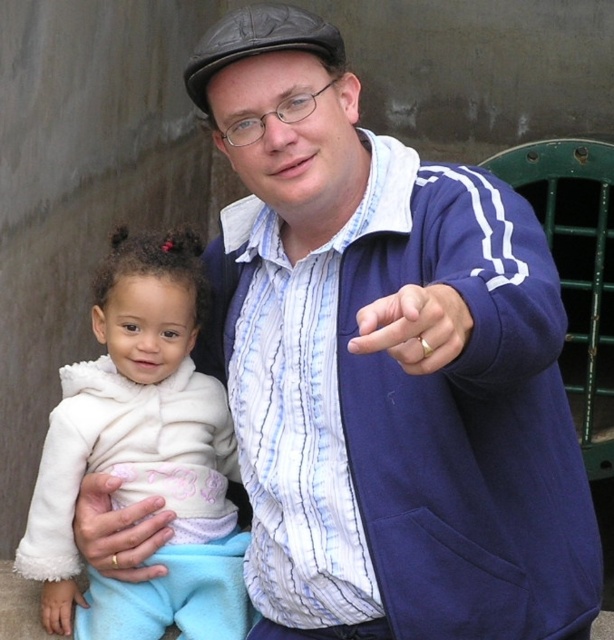
In the scene shown: You are a photographer setting up for a family portrait. You need to ensure that the blue fleece jacket at center and the gold ring at lower left are both visible in the frame. Based on their sizes, which object will appear larger in the final photo?

The blue fleece jacket at center will appear larger in the final photo because it is taller than the gold ring at lower left.

You are a photographer setting up for a family photo shoot. You notice the white fluffy coat at left and the gold ring at lower left in the scene. Where should you place your camera to ensure both items are visible in the frame?

Place the camera to the left side of the scene so that the white fluffy coat at left, which is to the right of the gold ring at lower left, remains in view along with the ring.